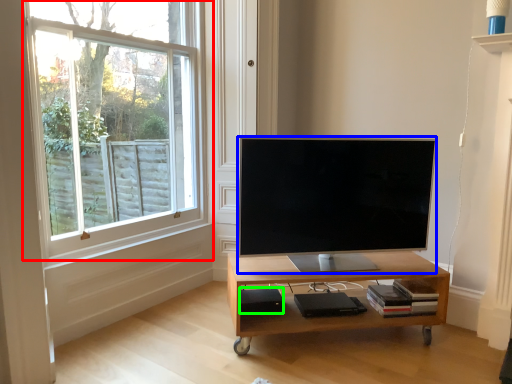
Question: Which object is positioned closest to window (highlighted by a red box)? Select from television (highlighted by a blue box) and speaker (highlighted by a green box).

Choices:
 (A) television
 (B) speaker

Answer: (A)